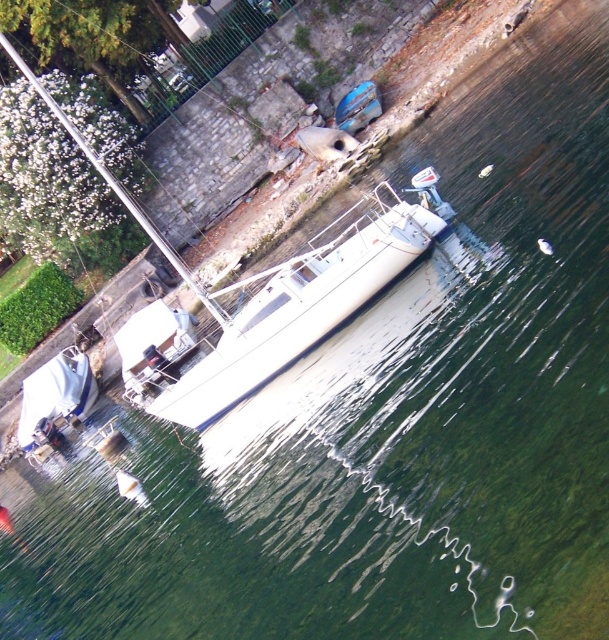
You are a photographer standing on the dock and want to capture both the white glossy sailboat at center and the blue glossy surfboard at upper center in a single photo. Which object should you adjust your camera angle to focus on first to ensure both are in frame?

The white glossy sailboat at center is below the blue glossy surfboard at upper center, so you should adjust your camera angle to focus on the blue glossy surfboard at upper center first to ensure both are in frame.

You are standing at the edge of the marina and see the point marked at coordinates (289,312). What object is located at that point?

The point at coordinates (289,312) corresponds to the white glossy boat at center.